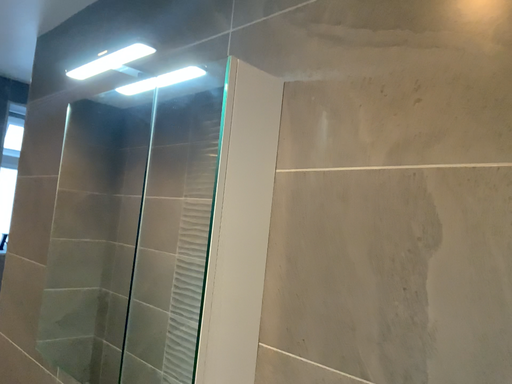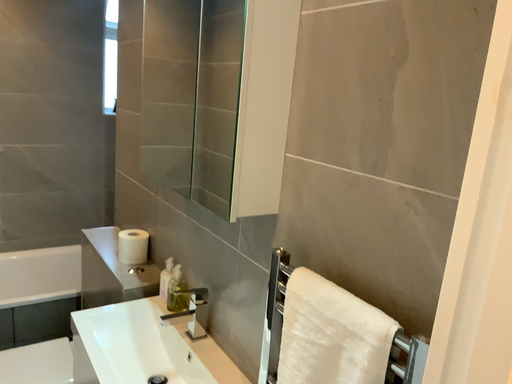
Question: Which way did the camera rotate in the video?

Choices:
 (A) rotated upward
 (B) rotated downward

Answer: (B)